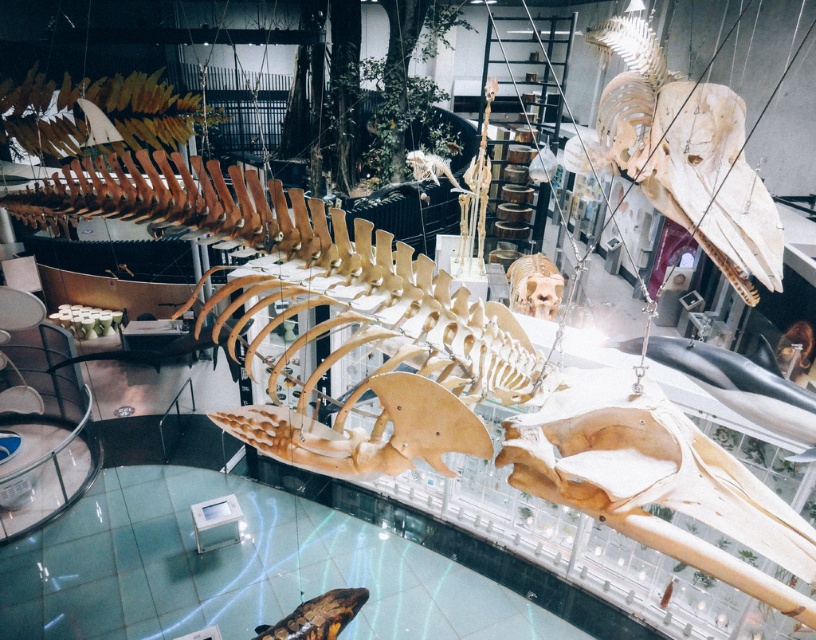
You are a visitor standing in the museum and want to take a photo of the two points mentioned. Which point is closer to you, point (78, 516) or point (515, 264)?

Point (78, 516) is in front of point (515, 264), so it is closer to you.

You are a visitor in the museum and want to take a photo of the smooth gray dolphin at center without any obstructions. Is the light brown bone at upper center blocking your view of the dolphin?

The smooth gray dolphin at center is behind the light brown bone at upper center, so the bone is blocking the view of the dolphin. You will need to move to a different angle to capture the dolphin without obstruction.

You are a museum visitor standing in front of the display. You want to take a photo of both the smooth gray dolphin at center and the brown matte skull at center. Which object should you focus on first if you want to capture both in the same frame without moving your camera?

The smooth gray dolphin at center is shorter than the brown matte skull at center, so you should focus on the brown matte skull at center first to ensure both fit in the frame.